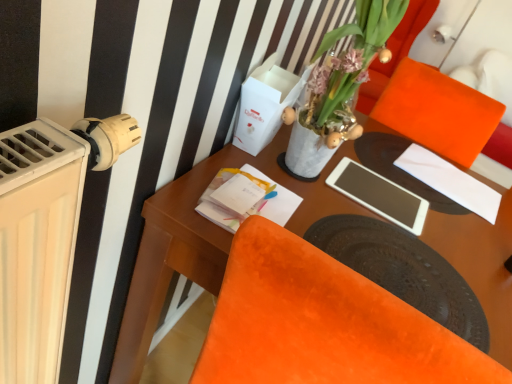
Question: Should I look upward or downward to see white matte tablet at center?

Choices:
 (A) up
 (B) down

Answer: (B)

Question: Is orange velvet armchair at upper right at the left side of white paper at upper right?

Choices:
 (A) yes
 (B) no

Answer: (B)

Question: Does orange velvet armchair at upper right have a lesser width compared to white paper at upper right?

Choices:
 (A) no
 (B) yes

Answer: (A)

Question: Considering the relative sizes of orange velvet armchair at upper right and white paper at upper right in the image provided, is orange velvet armchair at upper right smaller than white paper at upper right?

Choices:
 (A) yes
 (B) no

Answer: (B)

Question: Does orange velvet armchair at upper right turn towards white paper at upper right?

Choices:
 (A) yes
 (B) no

Answer: (A)

Question: Can you confirm if orange velvet armchair at upper right is positioned to the right of white paper at upper right?

Choices:
 (A) yes
 (B) no

Answer: (A)

Question: From a real-world perspective, is orange velvet armchair at upper right physically above white paper at upper right?

Choices:
 (A) yes
 (B) no

Answer: (B)

Question: From a real-world perspective, is translucent glass vase at upper center physically below orange velvet armchair at upper right?

Choices:
 (A) no
 (B) yes

Answer: (A)

Question: Considering the relative sizes of translucent glass vase at upper center and orange velvet armchair at upper right in the image provided, is translucent glass vase at upper center thinner than orange velvet armchair at upper right?

Choices:
 (A) yes
 (B) no

Answer: (A)

Question: Could you tell me if translucent glass vase at upper center is turned towards orange velvet armchair at upper right?

Choices:
 (A) no
 (B) yes

Answer: (A)

Question: Is translucent glass vase at upper center positioned beyond the bounds of orange velvet armchair at upper right?

Choices:
 (A) yes
 (B) no

Answer: (A)

Question: Is translucent glass vase at upper center oriented away from orange velvet armchair at upper right?

Choices:
 (A) yes
 (B) no

Answer: (B)

Question: Is translucent glass vase at upper center to the right of orange velvet armchair at upper right from the viewer's perspective?

Choices:
 (A) no
 (B) yes

Answer: (A)

Question: Is wooden desk at center smaller than translucent glass vase at upper center?

Choices:
 (A) yes
 (B) no

Answer: (B)